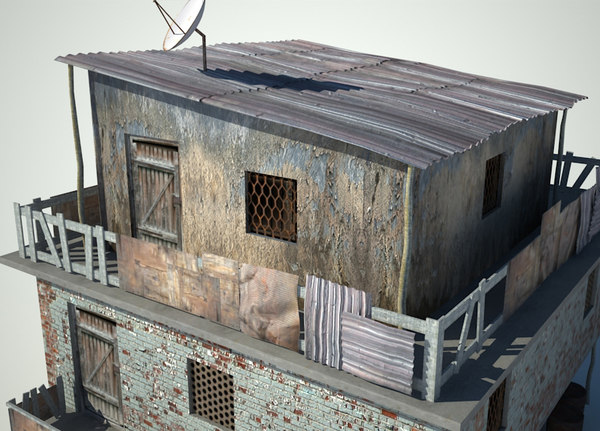
Locate an element on the screen. door is located at coordinates (103, 353).